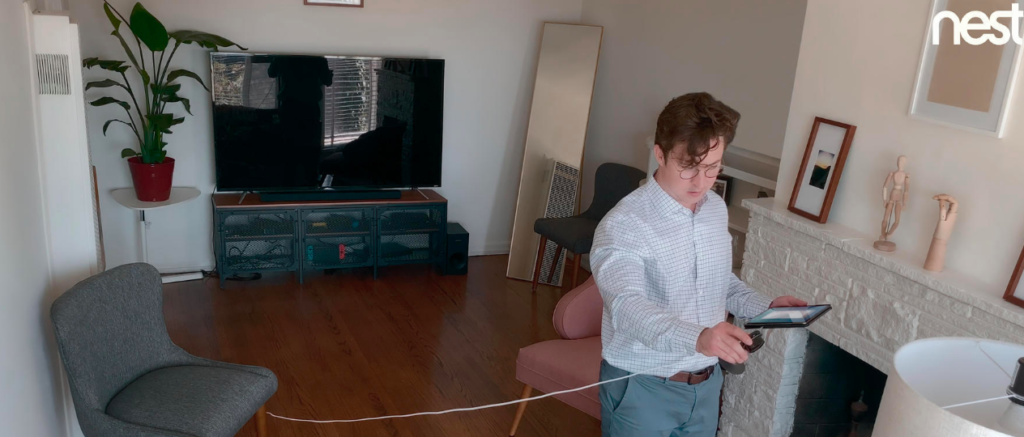
At what (x,y) coordinates should I click in order to perform the action: click on reflection of a window. Please return your answer as a coordinate pair (x, y). Looking at the image, I should click on (331, 96).